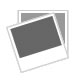
You are a GUI agent. You are given a task and a screenshot of the screen. Output one action in this format:
    pyautogui.click(x=<x>, y=<y>)
    Task: Click on the blank picture
    The image size is (80, 80).
    Given the screenshot: What is the action you would take?
    pyautogui.click(x=30, y=37), pyautogui.click(x=60, y=19)